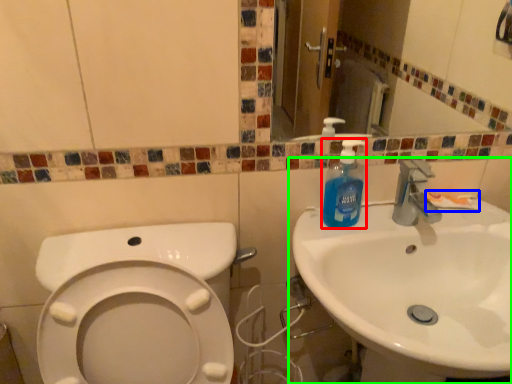
Question: Which object is positioned farthest from cleaning product (highlighted by a red box)? Select from toothpaste (highlighted by a blue box) and sink (highlighted by a green box).

Choices:
 (A) toothpaste
 (B) sink

Answer: (A)